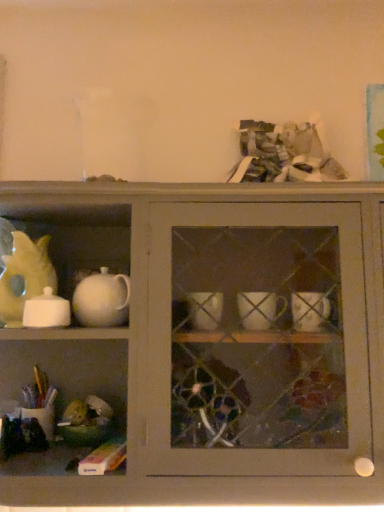
Question: Considering the relative sizes of white glossy sugar bowl at left and yellow matte teapot at left in the image provided, is white glossy sugar bowl at left smaller than yellow matte teapot at left?

Choices:
 (A) no
 (B) yes

Answer: (B)

Question: Can you confirm if white glossy sugar bowl at left is thinner than yellow matte teapot at left?

Choices:
 (A) yes
 (B) no

Answer: (B)

Question: Considering the relative sizes of white glossy sugar bowl at left and yellow matte teapot at left in the image provided, is white glossy sugar bowl at left wider than yellow matte teapot at left?

Choices:
 (A) yes
 (B) no

Answer: (A)

Question: Can you confirm if white glossy sugar bowl at left is positioned to the right of yellow matte teapot at left?

Choices:
 (A) no
 (B) yes

Answer: (B)

Question: Is white glossy sugar bowl at left placed right next to yellow matte teapot at left?

Choices:
 (A) yes
 (B) no

Answer: (A)

Question: From a real-world perspective, is white glossy sugar bowl at left below yellow matte teapot at left?

Choices:
 (A) no
 (B) yes

Answer: (B)

Question: From a real-world perspective, is yellow matte teapot at left under white glossy teapot at upper left?

Choices:
 (A) no
 (B) yes

Answer: (A)

Question: Is white glossy teapot at upper left at the back of yellow matte teapot at left?

Choices:
 (A) yes
 (B) no

Answer: (A)

Question: Can you confirm if yellow matte teapot at left is taller than white glossy teapot at upper left?

Choices:
 (A) no
 (B) yes

Answer: (A)

Question: Is yellow matte teapot at left to the right of white glossy teapot at upper left from the viewer's perspective?

Choices:
 (A) no
 (B) yes

Answer: (A)

Question: From the image's perspective, is yellow matte teapot at left located above white glossy teapot at upper left?

Choices:
 (A) yes
 (B) no

Answer: (A)

Question: From the image's perspective, is yellow matte teapot at left beneath white glossy teapot at upper left?

Choices:
 (A) no
 (B) yes

Answer: (A)

Question: Is white glossy sugar bowl at left next to white glossy teapot at upper left?

Choices:
 (A) yes
 (B) no

Answer: (B)